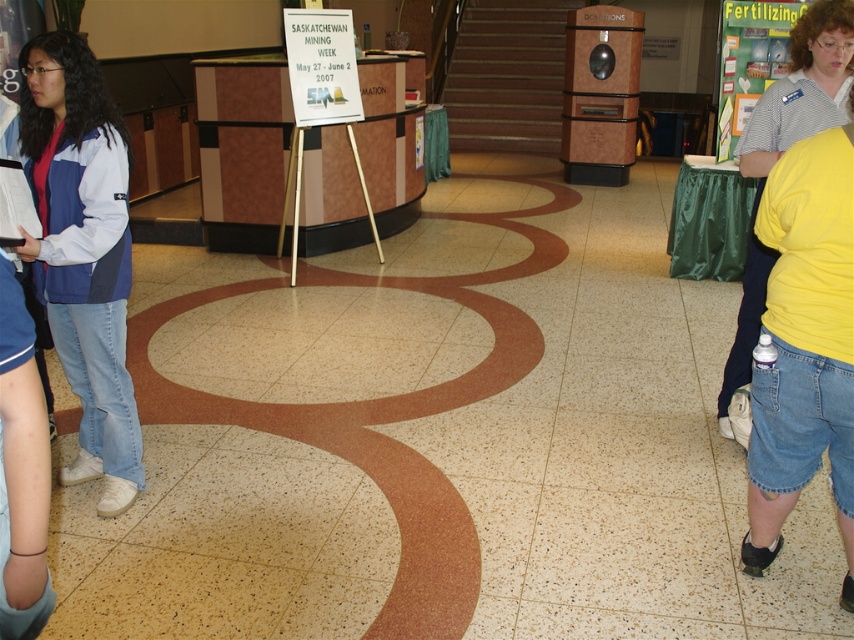
Looking at this image, you are standing in the lobby and need to place a 7 meter long banner between the yellow cotton shirt at right and the wooden donation box at center. Is there enough space?

The yellow cotton shirt at right and wooden donation box at center are 6.53 meters apart, so the 7 meter long banner cannot be placed between them as the distance is shorter than the banner length.

You are navigating through the lobby and need to reach a specific location marked by point coordinates. Which point, point (x=763, y=284) or point (x=600, y=179), is closer to you as you stand at the entrance?

Point (x=763, y=284) is closer to the viewer than point (x=600, y=179), so you should head towards point (x=763, y=284) first.